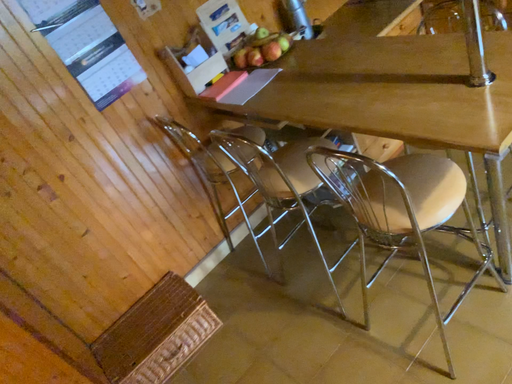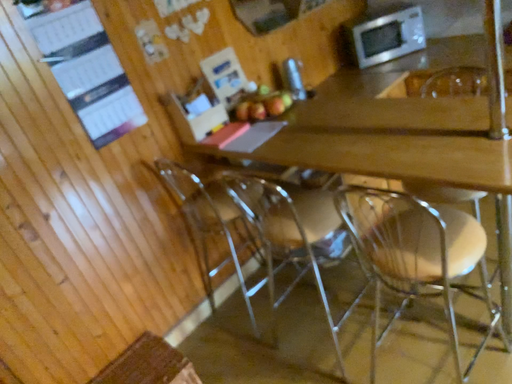
Question: Which way did the camera rotate in the video?

Choices:
 (A) rotated left
 (B) rotated right

Answer: (B)